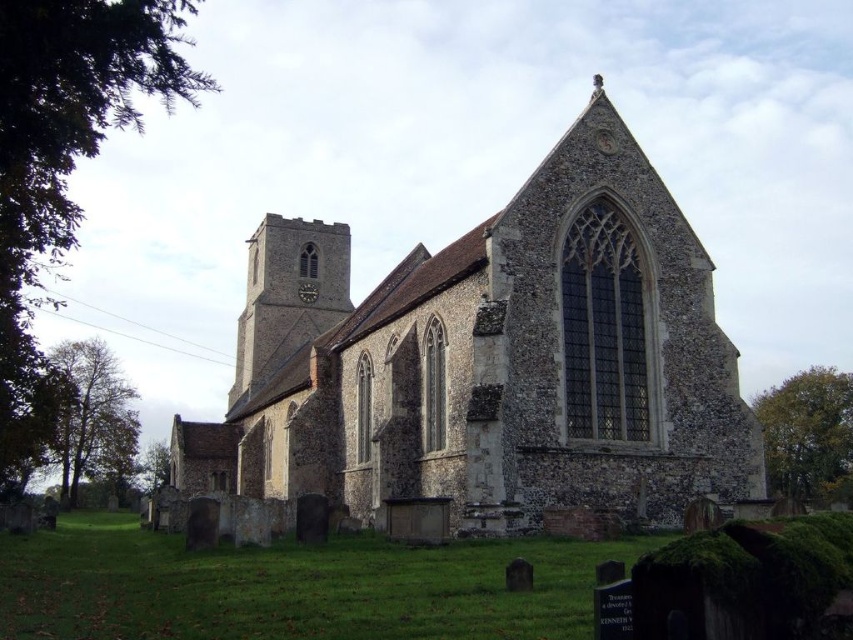
Question: Does brown stone church at center appear on the left side of stone clock tower at center-left?

Choices:
 (A) no
 (B) yes

Answer: (A)

Question: Which point is closer to the camera?

Choices:
 (A) stone clock tower at center-left
 (B) brown stone church at center

Answer: (B)

Question: Is brown stone church at center bigger than stone clock tower at center-left?

Choices:
 (A) yes
 (B) no

Answer: (A)

Question: Is brown stone church at center positioned behind stone clock tower at center-left?

Choices:
 (A) no
 (B) yes

Answer: (A)